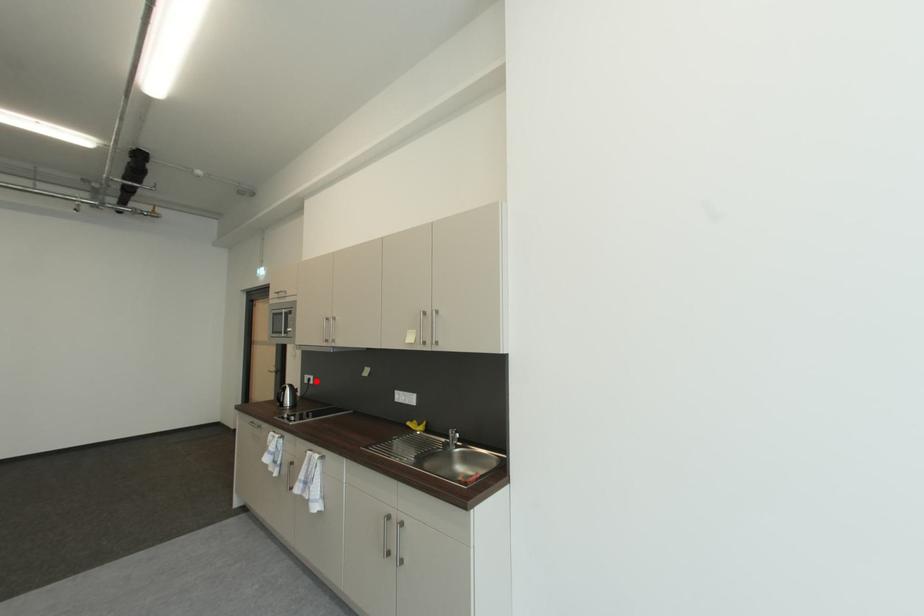
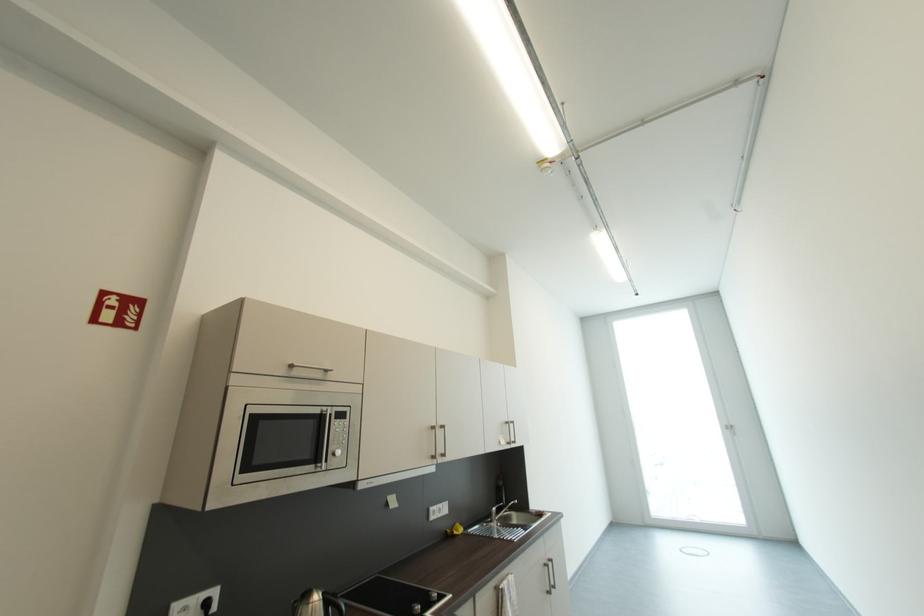
Question: I am providing you with two images of the same scene from different viewpoints. In image1, a red point is highlighted. Considering the same 3D point in image2, which of the following is correct?

Choices:
 (A) It is closer
 (B) It is farther

Answer: (A)